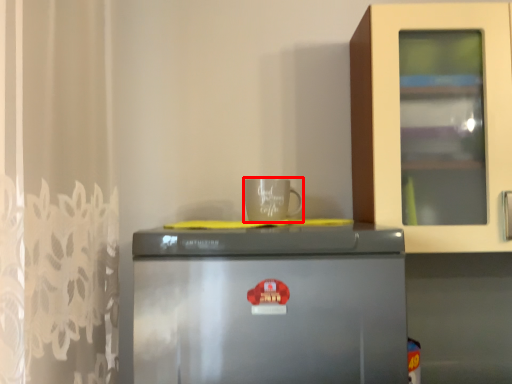
Question: Observing the image, what is the correct spatial positioning of coffee cup (annotated by the red box) in reference to refrigerator?

Choices:
 (A) right
 (B) left

Answer: (A)